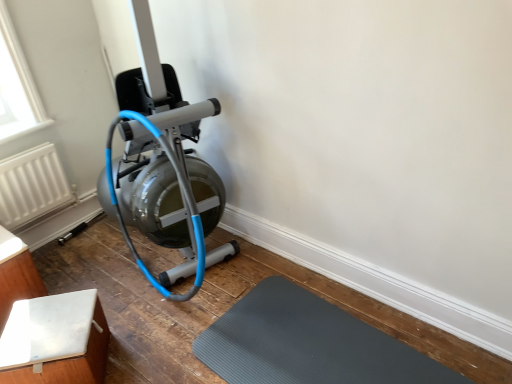
Identify the location of free area in between white matte table at lower left, the 1th furniture when ordered from right to left, and matte silver stationary bicycle at left. This screenshot has width=512, height=384. (124, 298).